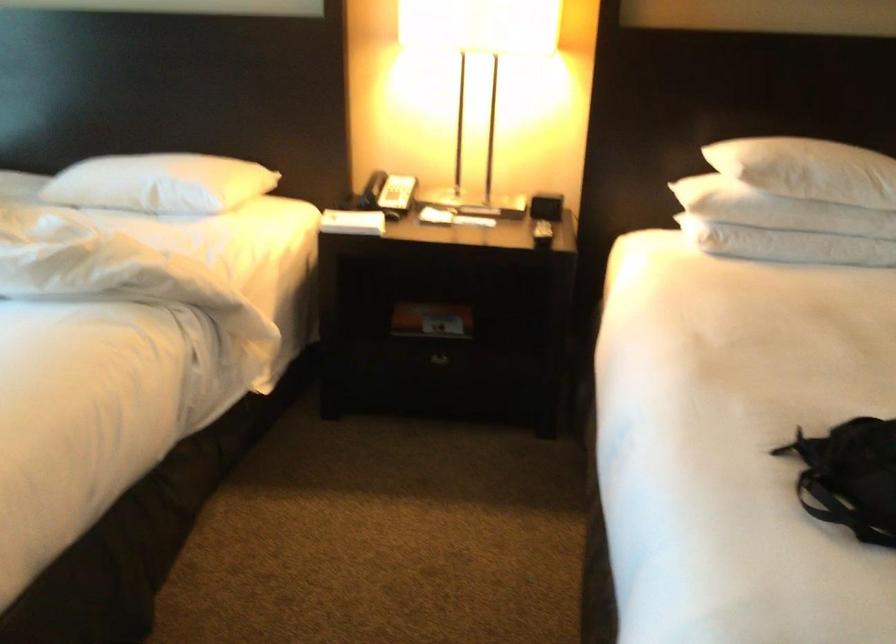
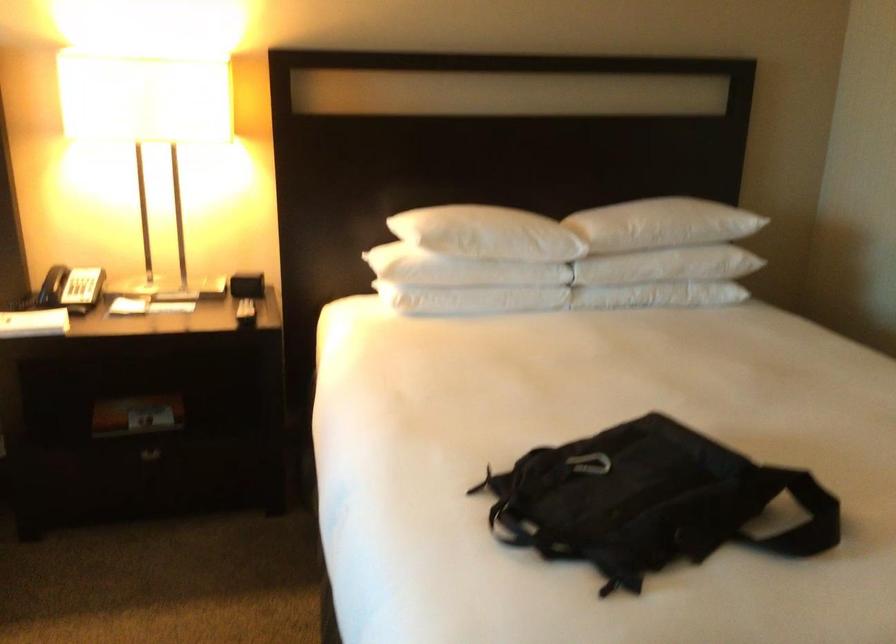
In a continuous first-person perspective shot, in which direction is the camera moving?

The movement direction of the cameraman is right, backward.